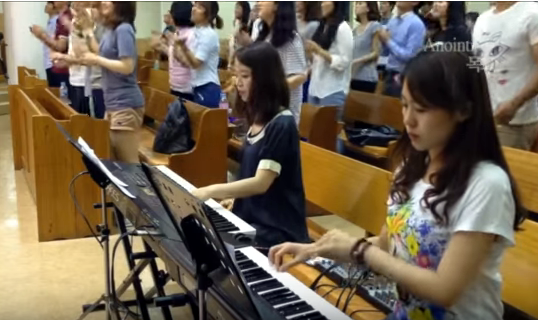
You are a GUI agent. You are given a task and a screenshot of the screen. Output one action in this format:
    pyautogui.click(x=<x>, y=<y>)
    Task: Click on the feet for sheet music stand
    This screenshot has height=320, width=538.
    Given the screenshot: What is the action you would take?
    pyautogui.click(x=106, y=290)